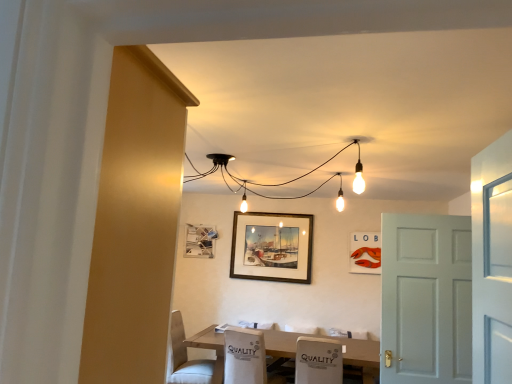
What do you see at coordinates (200, 241) in the screenshot? I see `metallic silver picture frame at lower left, the third picture frame viewed from the right` at bounding box center [200, 241].

The width and height of the screenshot is (512, 384). In order to click on white fabric chair at lower left, the second chair from the right in this screenshot , I will do `click(186, 358)`.

What is the approximate height of white fabric chair at lower center, positioned as the second chair in left-to-right order?

white fabric chair at lower center, positioned as the second chair in left-to-right order, is 61.97 centimeters tall.

Locate an element on the screen. The width and height of the screenshot is (512, 384). wooden picture frame at center, which ranks as the second picture frame in right-to-left order is located at coordinates (272, 247).

Is wooden picture frame at center, the 2th picture frame from the left, taller than metallic silver picture frame at lower left, marked as the first picture frame in a left-to-right arrangement?

Correct, wooden picture frame at center, the 2th picture frame from the left, is much taller as metallic silver picture frame at lower left, marked as the first picture frame in a left-to-right arrangement.

Is wooden picture frame at center, which ranks as the second picture frame in right-to-left order, wider or thinner than metallic silver picture frame at lower left, marked as the first picture frame in a left-to-right arrangement?

In the image, wooden picture frame at center, which ranks as the second picture frame in right-to-left order, appears to be more narrow than metallic silver picture frame at lower left, marked as the first picture frame in a left-to-right arrangement.

From a real-world perspective, which object stands above the other?

metallic silver picture frame at lower left, the third picture frame viewed from the right.

How many degrees apart are the facing directions of wooden picture frame at center, which ranks as the second picture frame in right-to-left order, and metallic silver picture frame at lower left, marked as the first picture frame in a left-to-right arrangement?

There is a 0.00545-degree angle between the facing directions of wooden picture frame at center, which ranks as the second picture frame in right-to-left order, and metallic silver picture frame at lower left, marked as the first picture frame in a left-to-right arrangement.

From a real-world perspective, is white matte door at right located beneath metallic silver picture frame at lower left, marked as the first picture frame in a left-to-right arrangement?

Correct, in the physical world, white matte door at right is lower than metallic silver picture frame at lower left, marked as the first picture frame in a left-to-right arrangement.

Could you measure the distance between white matte door at right and metallic silver picture frame at lower left, marked as the first picture frame in a left-to-right arrangement?

white matte door at right is 9.36 feet away from metallic silver picture frame at lower left, marked as the first picture frame in a left-to-right arrangement.

From the image's perspective, count 3rd picture frames upward from the white matte door at right and point to it. Please provide its 2D coordinates.

[(200, 241)]

Does white matte door at right have a smaller size compared to metallic silver picture frame at lower left, the third picture frame viewed from the right?

No, white matte door at right is not smaller than metallic silver picture frame at lower left, the third picture frame viewed from the right.

From the picture: From the image's perspective, is white fabric chair at lower left, the second chair from the right, located beneath metallic silver picture frame at lower left, the third picture frame viewed from the right?

Yes, from the image's perspective, white fabric chair at lower left, the second chair from the right, is below metallic silver picture frame at lower left, the third picture frame viewed from the right.

Is white fabric chair at lower left, the second chair from the right, beside metallic silver picture frame at lower left, marked as the first picture frame in a left-to-right arrangement?

No.

Considering the relative sizes of white fabric chair at lower left, positioned as the 1th chair in left-to-right order, and metallic silver picture frame at lower left, the third picture frame viewed from the right, in the image provided, is white fabric chair at lower left, positioned as the 1th chair in left-to-right order, thinner than metallic silver picture frame at lower left, the third picture frame viewed from the right,?

No, white fabric chair at lower left, positioned as the 1th chair in left-to-right order, is not thinner than metallic silver picture frame at lower left, the third picture frame viewed from the right.

Between wooden picture frame at center, the 2th picture frame from the left, and white wood table at center, which one is positioned behind?

wooden picture frame at center, the 2th picture frame from the left, is further away from the camera.

From a real-world perspective, is wooden picture frame at center, which ranks as the second picture frame in right-to-left order, physically above white wood table at center?

Yes.

Between wooden picture frame at center, the 2th picture frame from the left, and white wood table at center, which one has more height?

Standing taller between the two is wooden picture frame at center, the 2th picture frame from the left.

Is white wood table at center to the right of wooden picture frame at center, which ranks as the second picture frame in right-to-left order, from the viewer's perspective?

Yes, white wood table at center is to the right of wooden picture frame at center, which ranks as the second picture frame in right-to-left order.

Based on the photo, would you say white wood table at center is outside wooden picture frame at center, which ranks as the second picture frame in right-to-left order?

Yes, white wood table at center is not within wooden picture frame at center, which ranks as the second picture frame in right-to-left order.

Consider the image. Is white wood table at center wider than wooden picture frame at center, which ranks as the second picture frame in right-to-left order?

Yes, white wood table at center is wider than wooden picture frame at center, which ranks as the second picture frame in right-to-left order.

How different are the orientations of white wood table at center and wooden picture frame at center, which ranks as the second picture frame in right-to-left order, in degrees?

0.00998 degrees.

Is white wood table at center touching white fabric chair at lower left, positioned as the 1th chair in left-to-right order?

No, white wood table at center is not in contact with white fabric chair at lower left, positioned as the 1th chair in left-to-right order.

Looking at the image, does white wood table at center seem bigger or smaller compared to white fabric chair at lower left, positioned as the 1th chair in left-to-right order?

Considering their sizes, white wood table at center takes up more space than white fabric chair at lower left, positioned as the 1th chair in left-to-right order.

Which is in front, point (221, 371) or point (178, 373)?

The point (178, 373) is closer.

Is wooden picture frame at center, the 2th picture frame from the left, in contact with matte plastic picture frame at upper right, which ranks as the third picture frame in left-to-right order?

They are not placed beside each other.

From a real-world perspective, does wooden picture frame at center, which ranks as the second picture frame in right-to-left order, sit lower than matte plastic picture frame at upper right, which ranks as the third picture frame in left-to-right order?

Yes, from a real-world perspective, wooden picture frame at center, which ranks as the second picture frame in right-to-left order, is under matte plastic picture frame at upper right, which ranks as the third picture frame in left-to-right order.

Is wooden picture frame at center, which ranks as the second picture frame in right-to-left order, oriented towards matte plastic picture frame at upper right, which ranks as the third picture frame in left-to-right order?

No, wooden picture frame at center, which ranks as the second picture frame in right-to-left order, is not aimed at matte plastic picture frame at upper right, which ranks as the third picture frame in left-to-right order.

From the image's perspective, which one is positioned lower, wooden picture frame at center, which ranks as the second picture frame in right-to-left order, or matte plastic picture frame at upper right, which ranks as the third picture frame in left-to-right order?

matte plastic picture frame at upper right, which ranks as the third picture frame in left-to-right order, is shown below in the image.

Where is `picture frame that is the 2nd object directly below the metallic silver picture frame at lower left, the third picture frame viewed from the right (from a real-world perspective)`? picture frame that is the 2nd object directly below the metallic silver picture frame at lower left, the third picture frame viewed from the right (from a real-world perspective) is located at coordinates (272, 247).

You are a GUI agent. You are given a task and a screenshot of the screen. Output one action in this format:
    pyautogui.click(x=<x>, y=<y>)
    Task: Click on the 3rd picture frame located above the white matte door at right (from a real-world perspective)
    
    Given the screenshot: What is the action you would take?
    pyautogui.click(x=200, y=241)

In the scene shown: From the image, which object appears to be farther from metallic silver picture frame at lower left, the third picture frame viewed from the right, matte plastic picture frame at upper right, which ranks as the third picture frame in left-to-right order, or wooden picture frame at center, the 2th picture frame from the left?

The object further to metallic silver picture frame at lower left, the third picture frame viewed from the right, is matte plastic picture frame at upper right, which ranks as the third picture frame in left-to-right order.

Considering their positions, is white fabric chair at lower left, positioned as the 1th chair in left-to-right order, positioned further to metallic silver picture frame at lower left, marked as the first picture frame in a left-to-right arrangement, than white wood table at center?

Based on the image, white wood table at center appears to be further to metallic silver picture frame at lower left, marked as the first picture frame in a left-to-right arrangement.

Looking at the image, which one is located further to matte plastic picture frame at upper right, which appears as the 1th picture frame when viewed from the right, metallic silver picture frame at lower left, marked as the first picture frame in a left-to-right arrangement, or white matte door at right?

Based on the image, white matte door at right appears to be further to matte plastic picture frame at upper right, which appears as the 1th picture frame when viewed from the right.

Looking at the image, which one is located closer to white wood table at center, white matte door at right or white fabric chair at lower left, the second chair from the right?

white fabric chair at lower left, the second chair from the right, is positioned closer to the anchor white wood table at center.

From the picture: Considering their positions, is metallic silver picture frame at lower left, the third picture frame viewed from the right, positioned closer to wooden picture frame at center, the 2th picture frame from the left, than white fabric chair at lower left, the second chair from the right?

metallic silver picture frame at lower left, the third picture frame viewed from the right.

Estimate the real-world distances between objects in this image. Which object is closer to white fabric chair at lower left, positioned as the 1th chair in left-to-right order, matte plastic picture frame at upper right, which appears as the 1th picture frame when viewed from the right, or white wood table at center?

The object closer to white fabric chair at lower left, positioned as the 1th chair in left-to-right order, is white wood table at center.

Consider the image. Considering their positions, is white matte door at right positioned further to white wood table at center than wooden picture frame at center, which ranks as the second picture frame in right-to-left order?

white matte door at right is positioned further to the anchor white wood table at center.

Based on their spatial positions, is white fabric armchair at lower center or metallic silver picture frame at lower left, the third picture frame viewed from the right, further from white wood table at center?

The object further to white wood table at center is metallic silver picture frame at lower left, the third picture frame viewed from the right.

Where is `chair situated between white fabric chair at lower left, positioned as the 1th chair in left-to-right order, and white fabric armchair at lower center from left to right`? This screenshot has width=512, height=384. chair situated between white fabric chair at lower left, positioned as the 1th chair in left-to-right order, and white fabric armchair at lower center from left to right is located at coordinates (244, 356).

Locate an element on the screen. The width and height of the screenshot is (512, 384). armchair situated between white fabric chair at lower left, the second chair from the right, and white matte door at right from left to right is located at coordinates (318, 361).

The image size is (512, 384). I want to click on armchair located between white matte door at right and matte plastic picture frame at upper right, which appears as the 1th picture frame when viewed from the right, in the depth direction, so click(318, 361).

Find the location of a particular element. picture frame between white fabric chair at lower left, the second chair from the right, and matte plastic picture frame at upper right, which appears as the 1th picture frame when viewed from the right is located at coordinates (272, 247).